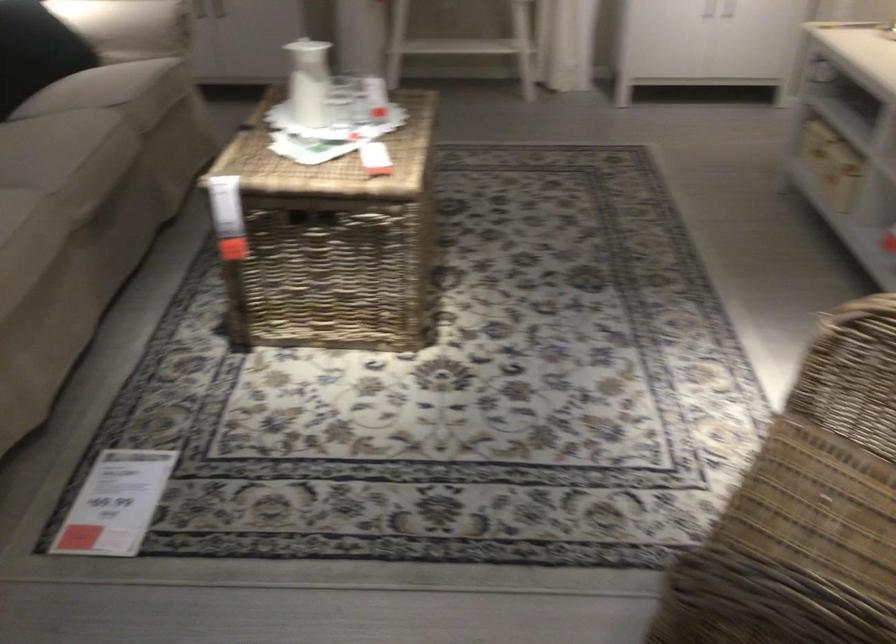
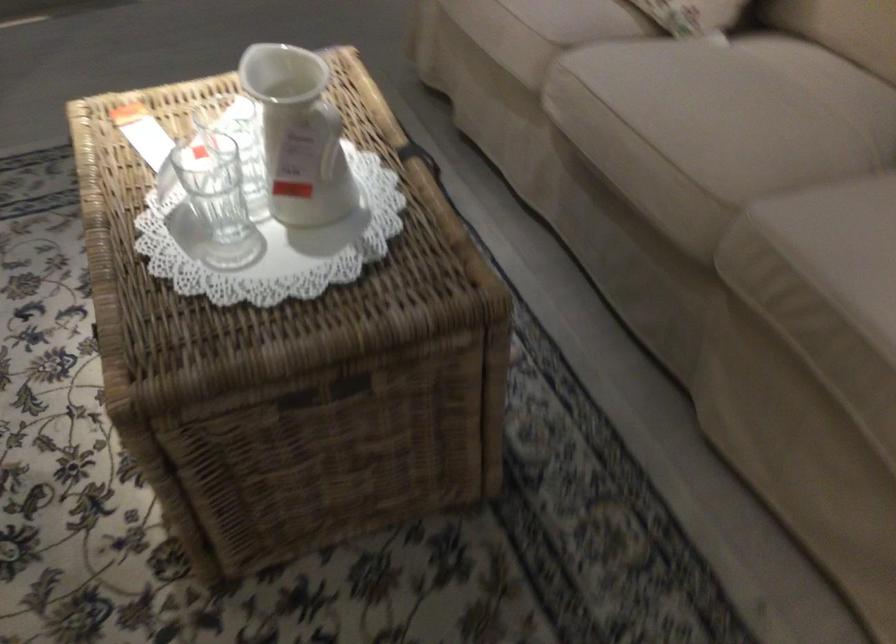
Locate, in the second image, the point that corresponds to [366,106] in the first image.

(212, 205)